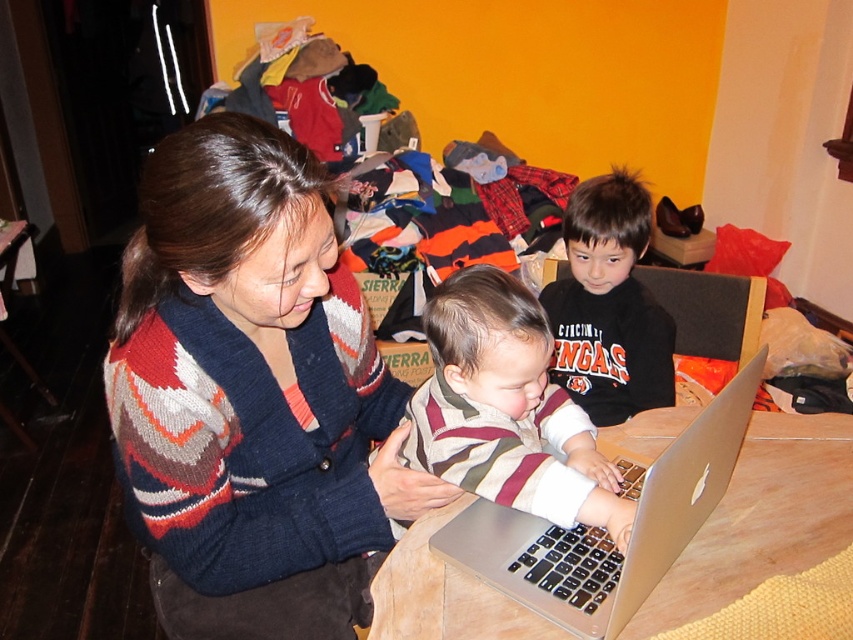
Can you confirm if knitted sweater at center is thinner than silver metallic laptop at center?

Incorrect, knitted sweater at center's width is not less than silver metallic laptop at center's.

Is knitted sweater at center closer to the viewer compared to silver metallic laptop at center?

That is False.

Where is `knitted sweater at center`? The height and width of the screenshot is (640, 853). knitted sweater at center is located at coordinates (251, 394).

Is point (468, 317) closer to camera compared to point (380, 557)?

Yes, point (468, 317) is closer to viewer.

Where is `striped fabric baby at center`? This screenshot has width=853, height=640. striped fabric baby at center is located at coordinates (506, 410).

You are a GUI agent. You are given a task and a screenshot of the screen. Output one action in this format:
    pyautogui.click(x=<x>, y=<y>)
    Task: Click on the striped fabric baby at center
    The width and height of the screenshot is (853, 640).
    Given the screenshot: What is the action you would take?
    pyautogui.click(x=506, y=410)

Who is shorter, black cotton shirt at center or dark blue fabric at lower center?

dark blue fabric at lower center

Who is more distant from viewer, (x=668, y=385) or (x=292, y=588)?

The point (x=668, y=385) is more distant.

Locate an element on the screen. black cotton shirt at center is located at coordinates (608, 305).